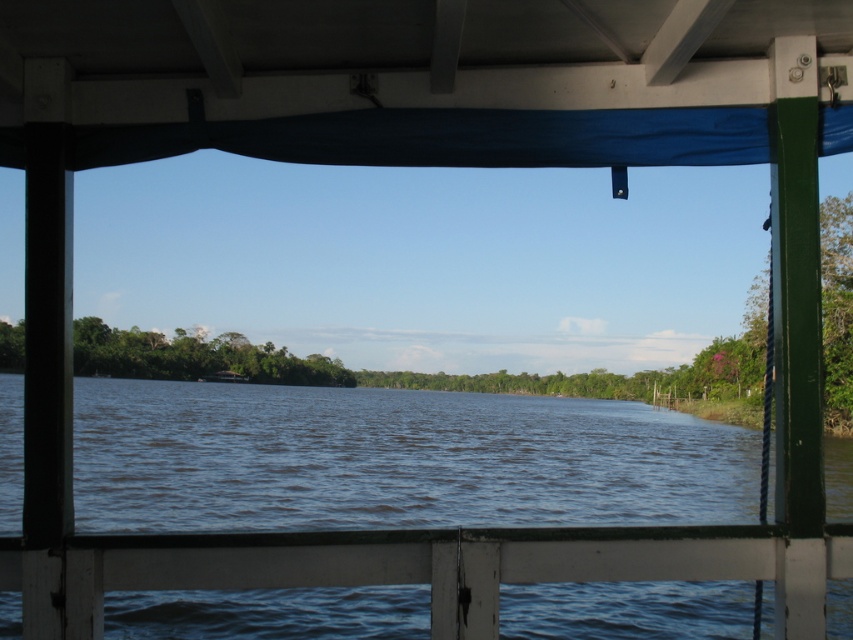
Question: Which object appears closest to the camera in this image?

Choices:
 (A) white painted wood rail at lower center
 (B) blue water at center

Answer: (A)

Question: Which point is closer to the camera?

Choices:
 (A) blue water at center
 (B) white painted wood rail at lower center

Answer: (B)

Question: Is blue water at center to the right of white painted wood rail at lower center from the viewer's perspective?

Choices:
 (A) no
 (B) yes

Answer: (A)

Question: Is blue water at center further to the viewer compared to white painted wood rail at lower center?

Choices:
 (A) no
 (B) yes

Answer: (B)

Question: In this image, where is blue water at center located relative to white painted wood rail at lower center?

Choices:
 (A) above
 (B) below

Answer: (B)